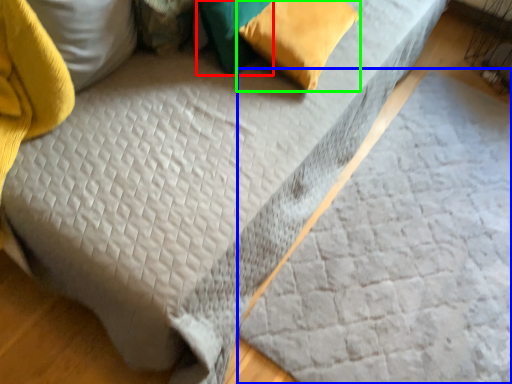
Question: Which object is positioned farthest from pillow (highlighted by a red box)? Select from sheet (highlighted by a blue box) and pillow (highlighted by a green box).

Choices:
 (A) sheet
 (B) pillow

Answer: (A)